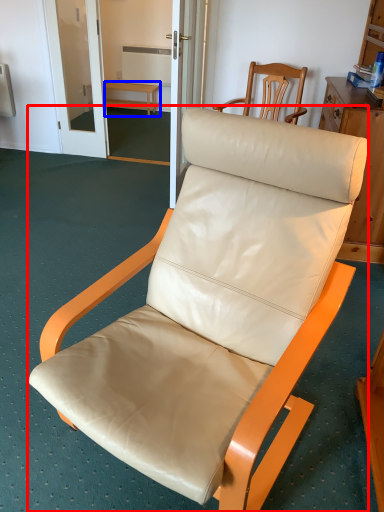
Question: Among these objects, which one is farthest to the camera, chair (highlighted by a red box) or furniture (highlighted by a blue box)?

Choices:
 (A) chair
 (B) furniture

Answer: (B)